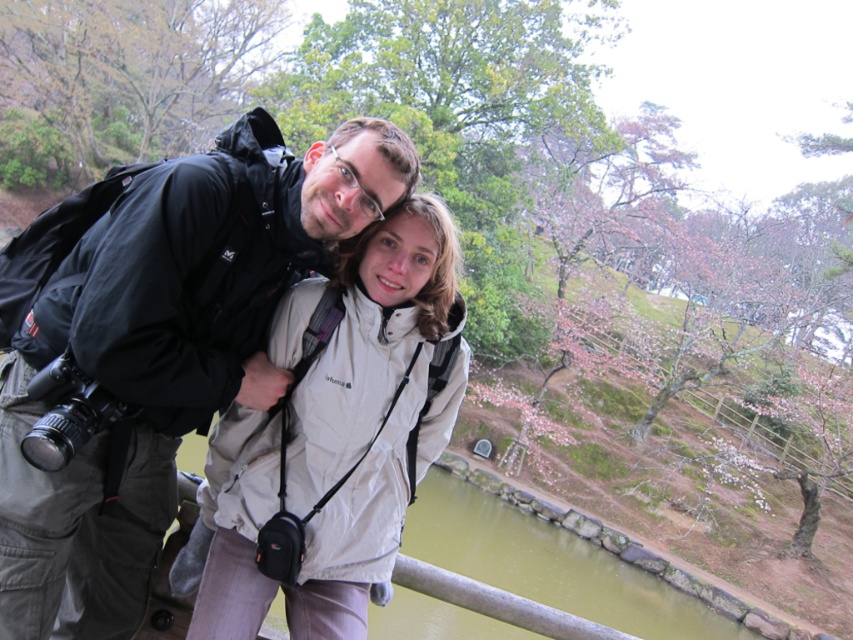
You are a photographer trying to capture a photo of both the matte black jacket at left and the white matte jacket at center. Based on their positions, which jacket will appear larger in the photo?

The matte black jacket at left will appear larger in the photo because it is closer to the viewer than the white matte jacket at center.

You are a photographer trying to position yourself to capture the matte black jacket at left in the frame. What are the coordinates where you should aim your camera?

The coordinates to aim your camera are at point (x=167, y=349) to capture the matte black jacket at left.

You are a tailor who needs to determine which jacket requires more fabric for alterations. Based on the image, which of the two jackets, the matte black jacket at left or the white matte jacket at center, has a greater width?

The matte black jacket at left has a greater width than the white matte jacket at center, so it would require more fabric for alterations.